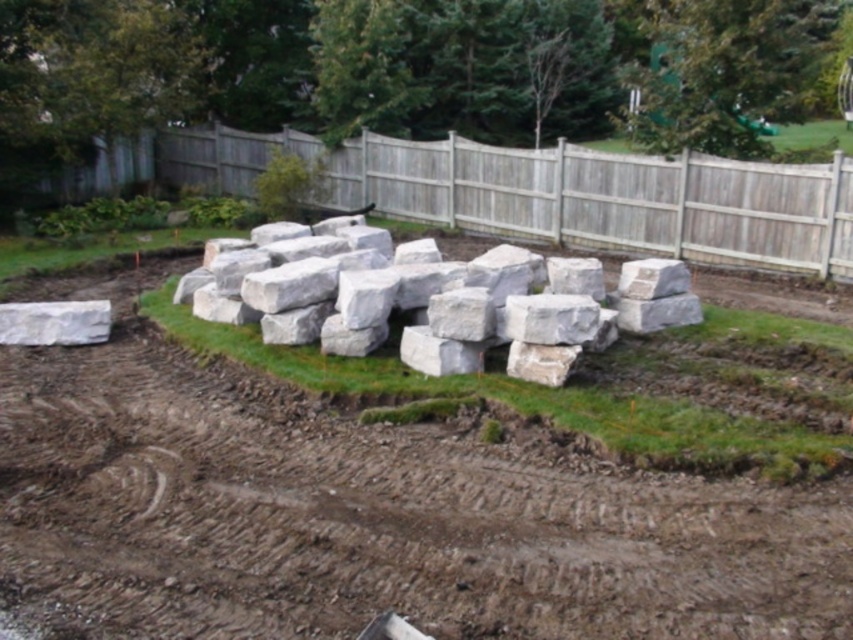
You are a painter who needs to paint both the gray wood fence at center and the white smooth boulder at left. Since you want to paint the tallest object first, which one should you start with?

The gray wood fence at center is taller than the white smooth boulder at left, so you should start painting the gray wood fence at center first.

You are standing in the backyard and want to walk to the white smooth boulder at left. Which direction should you move to reach it first, considering the brown soil at lower left is in your way?

Since the brown soil at lower left is closer to you than the white smooth boulder at left, you should move towards the left to bypass the brown soil at lower left and reach the white smooth boulder at left.